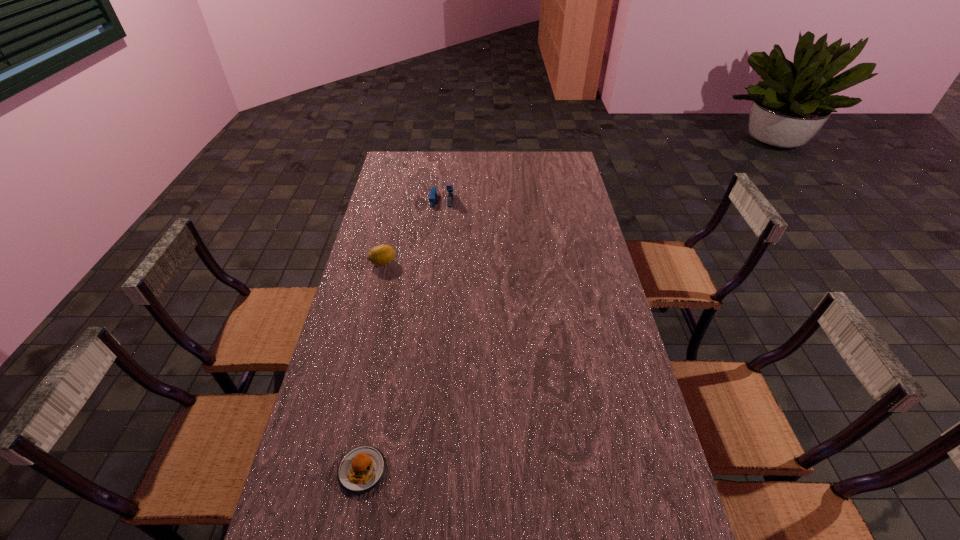
This screenshot has width=960, height=540. In order to click on unoccupied position between the shortest object and the stapler in this screenshot , I will do `click(402, 335)`.

Locate an element on the screen. empty space between the second tallest object and the food is located at coordinates (372, 367).

Locate an element on the screen. The image size is (960, 540). free space between the food and the second shortest object is located at coordinates (372, 367).

The image size is (960, 540). Identify the location of vacant space that's between the farthest object and the second shortest object. (412, 231).

This screenshot has height=540, width=960. In order to click on vacant point located between the nearest object and the tallest object in this screenshot , I will do `click(402, 335)`.

Locate an element on the screen. The height and width of the screenshot is (540, 960). empty space between the tallest object and the nearest object is located at coordinates (402, 335).

Identify the location of object that is the closest to the food. (380, 255).

This screenshot has height=540, width=960. I want to click on object that is the closest to the nearest object, so click(x=380, y=255).

Identify the location of vacant region that satisfies the following two spatial constraints: 1. at the stem end of the nearest object; 2. on the right side of the second shortest object. The width and height of the screenshot is (960, 540). (333, 470).

Locate an element on the screen. This screenshot has width=960, height=540. vacant space that satisfies the following two spatial constraints: 1. on the front side of the farthest object; 2. at the stem end of the second tallest object is located at coordinates (435, 262).